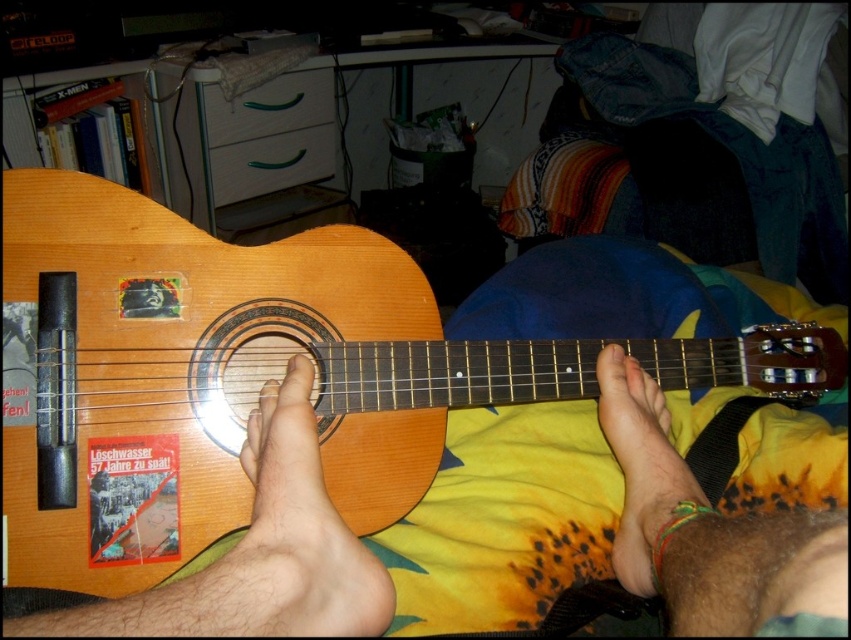
Question: In this image, where is natural wood guitar at center located relative to brown leather foot at lower right?

Choices:
 (A) below
 (B) above

Answer: (B)

Question: Which point is farther from the camera taking this photo?

Choices:
 (A) (646, 397)
 (B) (180, 240)

Answer: (A)

Question: Which of the following is the farthest from the observer?

Choices:
 (A) brown leather foot at lower right
 (B) natural wood guitar at center

Answer: (B)

Question: Considering the relative positions of natural wood guitar at center and brown leather foot at lower right in the image provided, where is natural wood guitar at center located with respect to brown leather foot at lower right?

Choices:
 (A) left
 (B) right

Answer: (A)

Question: Among these points, which one is farthest from the camera?

Choices:
 (A) (141, 392)
 (B) (655, 532)

Answer: (A)

Question: Is natural wood guitar at center positioned at the back of brown leather foot at lower right?

Choices:
 (A) yes
 (B) no

Answer: (A)